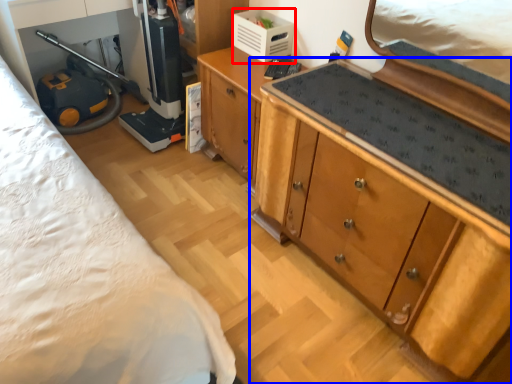
Question: Which object appears farthest to the camera in this image, appliance (highlighted by a red box) or cabinetry (highlighted by a blue box)?

Choices:
 (A) appliance
 (B) cabinetry

Answer: (A)